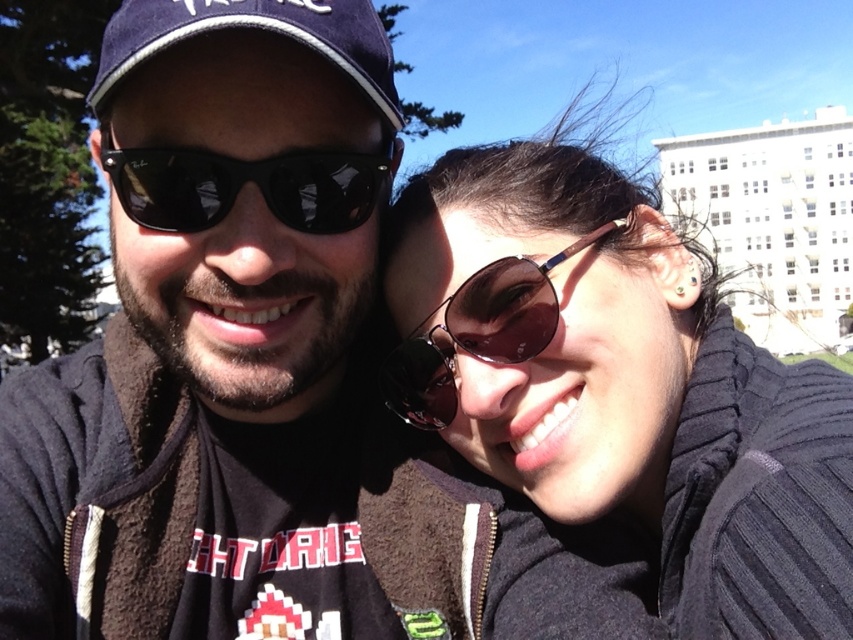
You are a photographer trying to capture a closeup of the matte black sunglasses at center. Based on their position coordinates, where should you aim your camera?

You should aim your camera at point 0.522 on the horizontal axis and 0.253 on the vertical axis to capture the matte black sunglasses at center.

You are a photographer trying to capture a closeup of the shiny dark sunglasses at center and the navy blue fabric baseball cap at upper left. Which object should you zoom in on first to ensure it appears larger in your photo?

The navy blue fabric baseball cap at upper left should be zoomed in on first because it is taller than the shiny dark sunglasses at center, making it naturally appear larger in the frame.

You are a photographer trying to capture the perfect shot of the matte black sunglasses at center and the navy blue fabric baseball cap at upper left. Which object should you focus on first if you want to ensure both are in sharp focus, considering their sizes in the frame?

The navy blue fabric baseball cap at upper left is smaller in the frame compared to the matte black sunglasses at center. To ensure both are in focus, start by focusing on the smaller object first as it requires more precise adjustment.